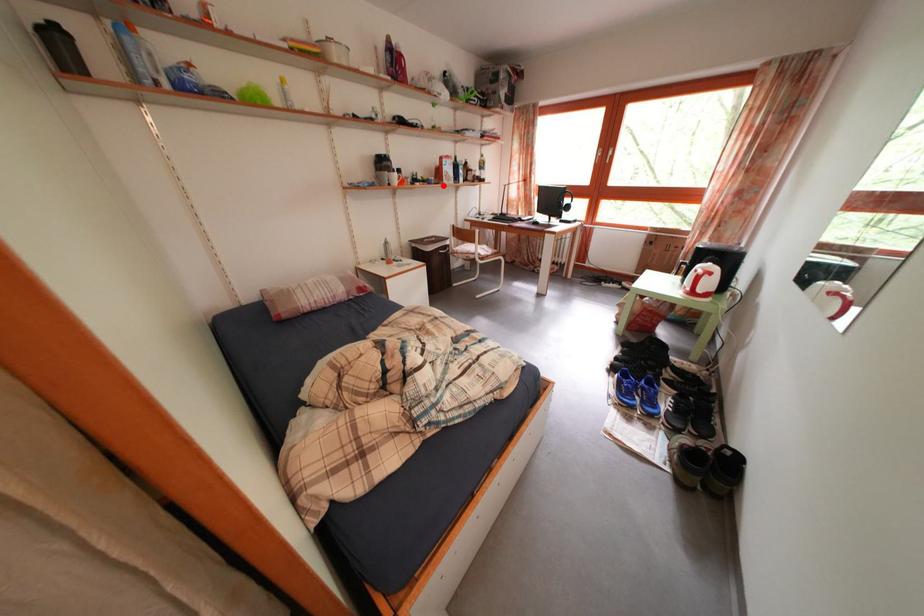
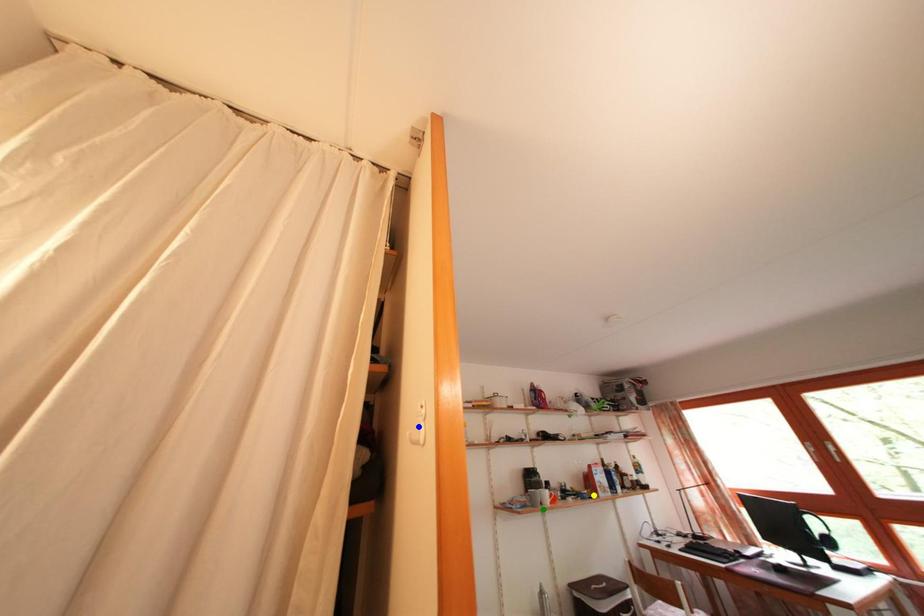
Question: I am providing you with two images of the same scene from different viewpoints. A red point is marked on the first image. You are given multiple points on the second image. Which point in image 2 represents the same 3d spot as the red point in image 1?

Choices:
 (A) blue point
 (B) green point
 (C) yellow point

Answer: (C)